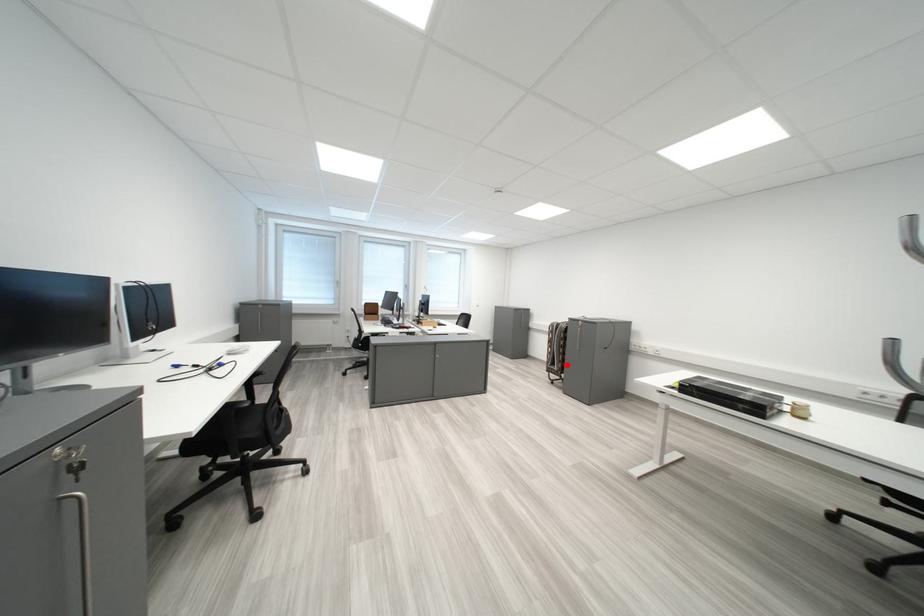
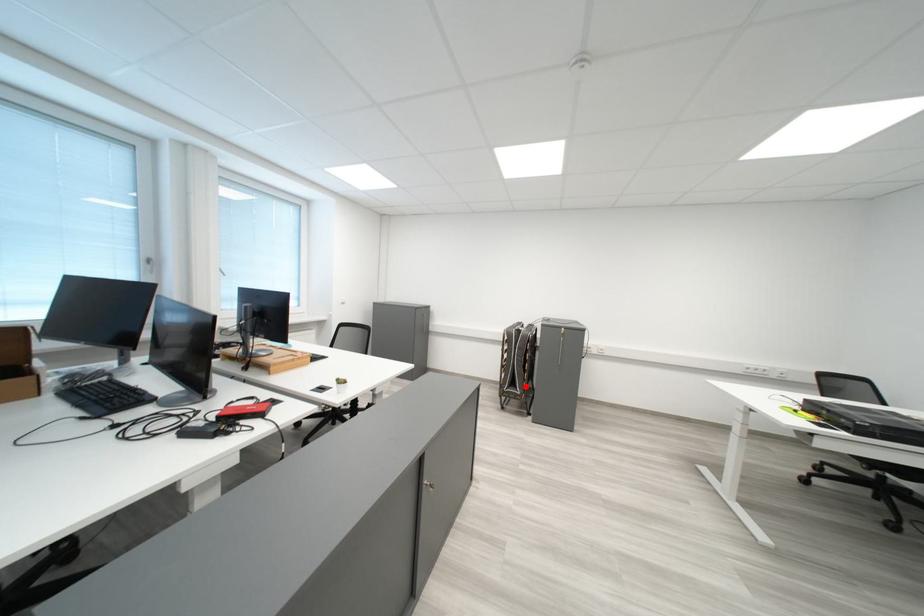
I am providing you with two images of the same scene from different viewpoints. A red point is marked on the first image and another point is marked on the second image. Do the highlighted points in image1 and image2 indicate the same real-world spot?

Yes